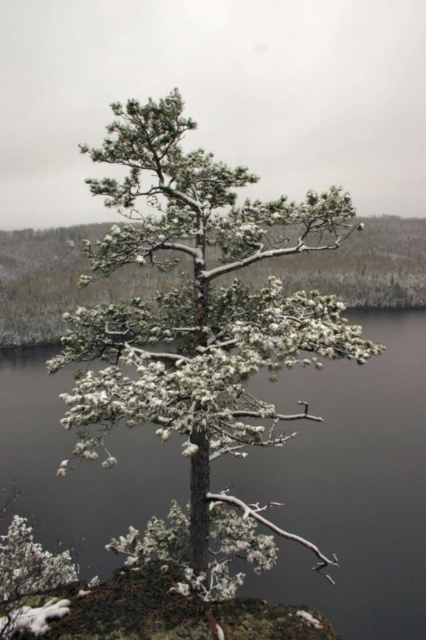
Does snow-covered pine tree at center have a lesser height compared to transparent water at center?

No.

How much distance is there between snow-covered pine tree at center and transparent water at center?

snow-covered pine tree at center is 27.06 feet away from transparent water at center.

The image size is (426, 640). I want to click on snow-covered pine tree at center, so click(x=198, y=301).